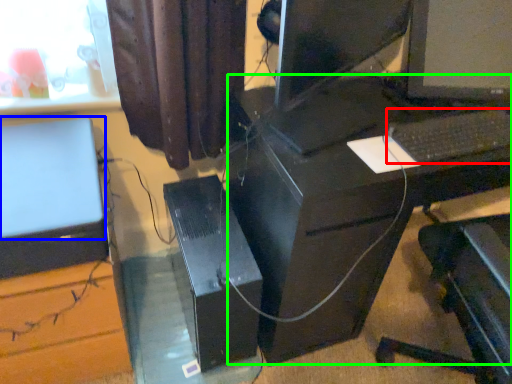
Question: Based on their relative distances, which object is farther from computer keyboard (highlighted by a red box)? Choose from computer monitor (highlighted by a blue box) and computer desk (highlighted by a green box).

Choices:
 (A) computer monitor
 (B) computer desk

Answer: (A)